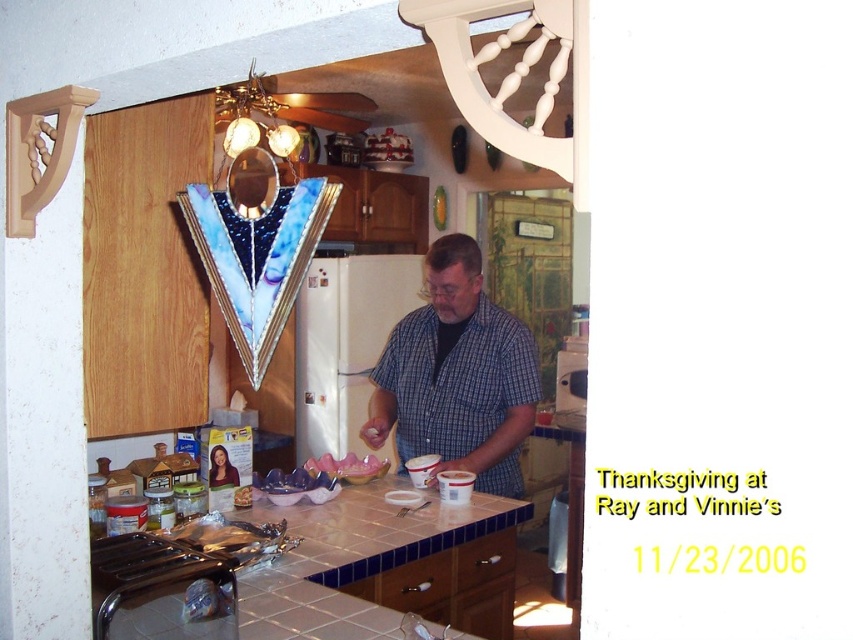
What do you see at coordinates (320, 572) in the screenshot?
I see `white tile countertop at center` at bounding box center [320, 572].

Measure the distance from white tile countertop at center to blue plaid shirt at center.

A distance of 18.90 inches exists between white tile countertop at center and blue plaid shirt at center.

This screenshot has height=640, width=853. I want to click on white tile countertop at center, so click(x=320, y=572).